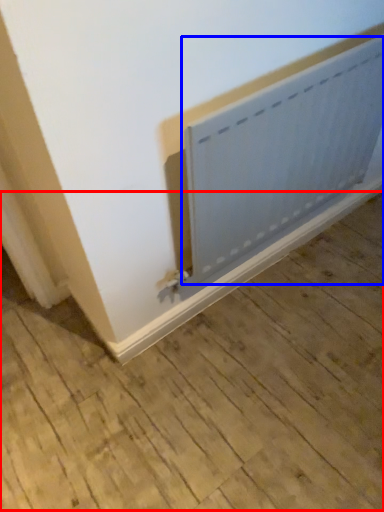
Question: Which object is closer to the camera taking this photo, plywood (highlighted by a red box) or radiator (highlighted by a blue box)?

Choices:
 (A) plywood
 (B) radiator

Answer: (A)